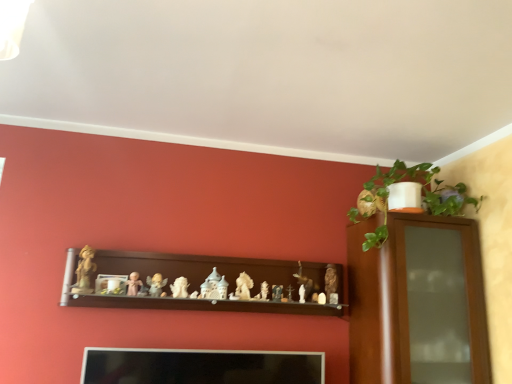
What do you see at coordinates (180, 287) in the screenshot?
I see `white glossy statue at center, the 8th toy in the right-to-left sequence` at bounding box center [180, 287].

Describe the element at coordinates (418, 302) in the screenshot. Image resolution: width=512 pixels, height=384 pixels. I see `wooden cabinet at upper right` at that location.

This screenshot has width=512, height=384. What do you see at coordinates (415, 195) in the screenshot?
I see `green glossy plant at upper right` at bounding box center [415, 195].

The image size is (512, 384). In order to click on matte white figurine at center, which ranks as the eighth toy in left-to-right order in this screenshot , I will do `click(277, 293)`.

This screenshot has height=384, width=512. Describe the element at coordinates (305, 282) in the screenshot. I see `matte gold figurine at center, which is counted as the second toy, starting from the right` at that location.

Identify the location of white glossy statue at center, the 8th toy in the right-to-left sequence. The width and height of the screenshot is (512, 384). (180, 287).

Which of these two, matte gold figurine at center, which is counted as the second toy, starting from the right, or smooth wooden cross at center, which ranks as the 3th toy in right-to-left order, is smaller?

With smaller size is smooth wooden cross at center, which ranks as the 3th toy in right-to-left order.

Considering their positions, is matte gold figurine at center, which is counted as the second toy, starting from the right, located in front of or behind smooth wooden cross at center, which ranks as the 3th toy in right-to-left order?

Clearly, matte gold figurine at center, which is counted as the second toy, starting from the right, is behind smooth wooden cross at center, which ranks as the 3th toy in right-to-left order.

Is matte gold figurine at center, which is counted as the second toy, starting from the right, far away from smooth wooden cross at center, which ranks as the 3th toy in right-to-left order?

That's not correct — matte gold figurine at center, which is counted as the second toy, starting from the right, is a little close to smooth wooden cross at center, which ranks as the 3th toy in right-to-left order.

In the scene shown: Is matte white angel at center, the third toy when ordered from left to right, touching smooth wooden cross at center, acting as the ninth toy starting from the left?

No, matte white angel at center, the third toy when ordered from left to right, is not beside smooth wooden cross at center, acting as the ninth toy starting from the left.

Does matte white angel at center, which is the ninth toy from right to left, have a larger size compared to smooth wooden cross at center, which ranks as the 3th toy in right-to-left order?

Indeed, matte white angel at center, which is the ninth toy from right to left, has a larger size compared to smooth wooden cross at center, which ranks as the 3th toy in right-to-left order.

Which is closer, (161, 277) or (290, 295)?

Positioned in front is point (161, 277).

In the image, is matte white angel at center, which is the ninth toy from right to left, on the left side or the right side of smooth wooden cross at center, acting as the ninth toy starting from the left?

matte white angel at center, which is the ninth toy from right to left, is positioned on smooth wooden cross at center, acting as the ninth toy starting from the left,'s left side.

From the image's perspective, which one is positioned higher, matte white figurine at center, which ranks as the seventh toy in left-to-right order, or matte white angel at center, which is the ninth toy from right to left?

matte white angel at center, which is the ninth toy from right to left.

Which is correct: matte white figurine at center, which ranks as the seventh toy in left-to-right order, is inside matte white angel at center, the third toy when ordered from left to right, or outside of it?

matte white figurine at center, which ranks as the seventh toy in left-to-right order, cannot be found inside matte white angel at center, the third toy when ordered from left to right.

Is matte white figurine at center, which ranks as the seventh toy in left-to-right order, to the right of matte white angel at center, the third toy when ordered from left to right, from the viewer's perspective?

Yes.

Which is less distant, (265, 290) or (154, 274)?

Point (265, 290) is farther from the camera than point (154, 274).

What are the coordinates of `toy that is the 10th one when counting backward from the brown wooden shelf at center` in the screenshot? It's located at (305, 282).

Does brown wooden shelf at center lie behind matte gold figurine at center, which is counted as the second toy, starting from the right?

No, brown wooden shelf at center is in front of matte gold figurine at center, which is counted as the second toy, starting from the right.

Looking at the image, does brown wooden shelf at center seem bigger or smaller compared to matte gold figurine at center, which is counted as the second toy, starting from the right?

In the image, brown wooden shelf at center appears to be larger than matte gold figurine at center, which is counted as the second toy, starting from the right.

Is white glossy statue at center, the 8th toy in the right-to-left sequence, positioned with its back to green glossy plant at upper right?

white glossy statue at center, the 8th toy in the right-to-left sequence, is not turned away from green glossy plant at upper right.

From the image's perspective, is white glossy statue at center, the 8th toy in the right-to-left sequence, above green glossy plant at upper right?

No, from the image's perspective, white glossy statue at center, the 8th toy in the right-to-left sequence, is not over green glossy plant at upper right.

Which object is further away from the camera, white glossy statue at center, the 8th toy in the right-to-left sequence, or green glossy plant at upper right?

white glossy statue at center, the 8th toy in the right-to-left sequence.

Is white glossy statue at center, the 8th toy in the right-to-left sequence, not inside green glossy plant at upper right?

Yes, white glossy statue at center, the 8th toy in the right-to-left sequence, is located beyond the bounds of green glossy plant at upper right.

Considering the relative sizes of brown wooden shelf at center and wooden cabinet at upper right in the image provided, is brown wooden shelf at center taller than wooden cabinet at upper right?

No, brown wooden shelf at center is not taller than wooden cabinet at upper right.

Looking at this image, does brown wooden shelf at center lie behind wooden cabinet at upper right?

Yes, it is behind wooden cabinet at upper right.

Considering the positions of points (253, 265) and (419, 263), is point (253, 265) farther from camera compared to point (419, 263)?

That is True.

In the scene shown: Measure the distance from brown wooden shelf at center to wooden cabinet at upper right.

24.60 inches.

From a real-world perspective, relative to matte white figurine at center, which ranks as the seventh toy in left-to-right order, is matte white angel at center, which is the ninth toy from right to left, vertically above or below?

matte white angel at center, which is the ninth toy from right to left, is situated higher than matte white figurine at center, which ranks as the seventh toy in left-to-right order, in the real world.

How distant is matte white angel at center, the third toy when ordered from left to right, from matte white figurine at center, which ranks as the seventh toy in left-to-right order?

matte white angel at center, the third toy when ordered from left to right, is 21.54 inches from matte white figurine at center, which ranks as the seventh toy in left-to-right order.

From the image's perspective, which object appears higher, matte white angel at center, the third toy when ordered from left to right, or matte white figurine at center, which is the fifth toy in right-to-left order?

matte white angel at center, the third toy when ordered from left to right, appears higher in the image.

Based on the photo, considering the positions of objects matte white angel at center, which is the ninth toy from right to left, and matte white figurine at center, which ranks as the seventh toy in left-to-right order, in the image provided, who is in front, matte white angel at center, which is the ninth toy from right to left, or matte white figurine at center, which ranks as the seventh toy in left-to-right order,?

matte white angel at center, which is the ninth toy from right to left, is in front.

At what (x,y) coordinates should I click in order to perform the action: click on the 9th toy located beneath the matte gold figurine at center, marked as the 10th toy in a left-to-right arrangement (from a real-world perspective). Please return your answer as a coordinate pair (x, y). The width and height of the screenshot is (512, 384). Looking at the image, I should click on (289, 293).

Which toy is the 6th one when counting from the front of the smooth wooden cross at center, acting as the ninth toy starting from the left? Please provide its 2D coordinates.

[(156, 284)]

Based on their spatial positions, is matte beige figurine at center, the 2th toy viewed from the left, or green glossy plant at upper right further from matte gold figurine at center, which is counted as the second toy, starting from the right?

matte beige figurine at center, the 2th toy viewed from the left, is further to matte gold figurine at center, which is counted as the second toy, starting from the right.

From the image, which object appears to be nearer to matte white figurine at center, which is the fifth toy in right-to-left order, white glossy statue at center, the 8th toy in the right-to-left sequence, or green glossy plant at upper right?

white glossy statue at center, the 8th toy in the right-to-left sequence, is closer to matte white figurine at center, which is the fifth toy in right-to-left order.

Considering their positions, is matte brown statue at center, arranged as the eleventh toy when viewed from the left, positioned further to wooden cabinet at upper right than smooth wooden cross at center, acting as the ninth toy starting from the left?

Among the two, smooth wooden cross at center, acting as the ninth toy starting from the left, is located further to wooden cabinet at upper right.

Considering their positions, is matte gold figurine at center, which is counted as the second toy, starting from the right, positioned closer to matte white figurine at center, which is the fifth toy in right-to-left order, than smooth wooden cross at center, acting as the ninth toy starting from the left?

smooth wooden cross at center, acting as the ninth toy starting from the left.

Looking at the image, which one is located closer to matte white figurine at center, which ranks as the eighth toy in left-to-right order, matte gold statue at left, placed as the 1th toy when sorted from left to right, or green glossy plant at upper right?

green glossy plant at upper right is closer to matte white figurine at center, which ranks as the eighth toy in left-to-right order.

Estimate the real-world distances between objects in this image. Which object is closer to wooden cabinet at upper right, smooth wooden cross at center, acting as the ninth toy starting from the left, or white porcelain statue at center, which ranks as the 6th toy in left-to-right order?

smooth wooden cross at center, acting as the ninth toy starting from the left, is positioned closer to the anchor wooden cabinet at upper right.

Estimate the real-world distances between objects in this image. Which object is closer to green glossy plant at upper right, matte gold statue at left, placed as the 1th toy when sorted from left to right, or white porcelain statue at center, placed as the 6th toy when sorted from right to left?

Based on the image, white porcelain statue at center, placed as the 6th toy when sorted from right to left, appears to be nearer to green glossy plant at upper right.

Looking at the image, which one is located further to smooth wooden cross at center, acting as the ninth toy starting from the left, matte brown statue at center, which is counted as the first toy, starting from the right, or wooden cabinet at upper right?

wooden cabinet at upper right lies further to smooth wooden cross at center, acting as the ninth toy starting from the left, than the other object.

Where is `shelf between matte beige figurine at center, the 2th toy viewed from the left, and smooth wooden cross at center, which ranks as the 3th toy in right-to-left order`? shelf between matte beige figurine at center, the 2th toy viewed from the left, and smooth wooden cross at center, which ranks as the 3th toy in right-to-left order is located at coordinates (193, 282).

This screenshot has width=512, height=384. Find the location of `shelf between matte beige figurine at center, which is the 10th toy from right to left, and matte gold figurine at center, which is counted as the second toy, starting from the right, from left to right`. shelf between matte beige figurine at center, which is the 10th toy from right to left, and matte gold figurine at center, which is counted as the second toy, starting from the right, from left to right is located at coordinates (193, 282).

Identify the location of shelf located between white glossy statue at center, positioned as the fourth toy in left-to-right order, and white porcelain statue at center, which ranks as the 6th toy in left-to-right order, in the left-right direction. (193, 282).

Locate an element on the screen. The width and height of the screenshot is (512, 384). shelf located between white glossy statue at center, the 8th toy in the right-to-left sequence, and matte gold figurine at center, which is counted as the second toy, starting from the right, in the left-right direction is located at coordinates (193, 282).